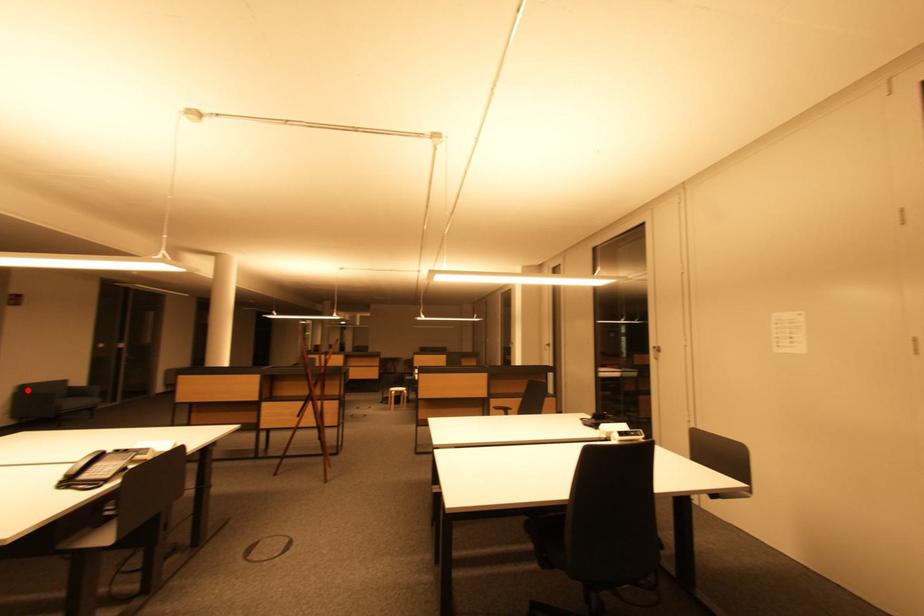
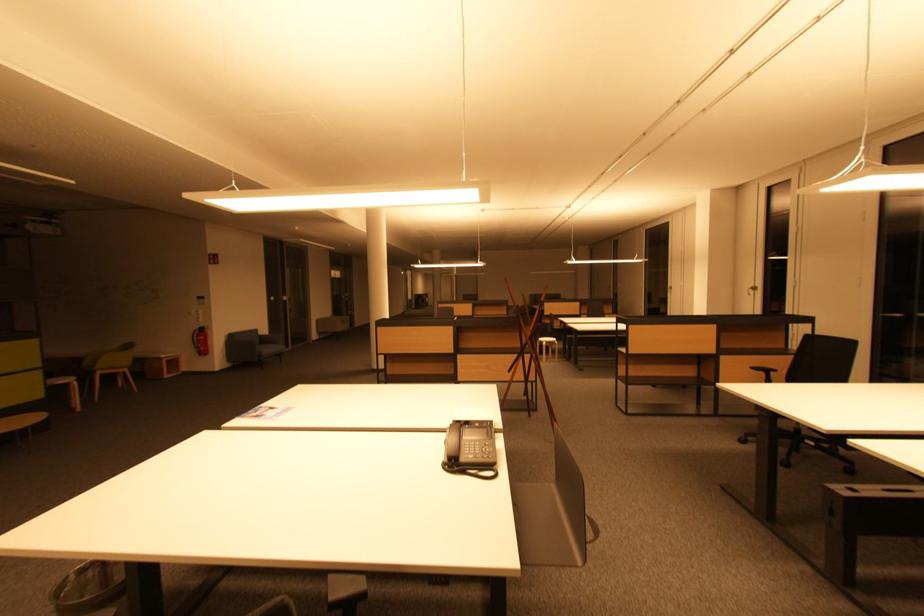
Locate, in the second image, the point that corresponds to the highlighted location in the first image.

(236, 339)